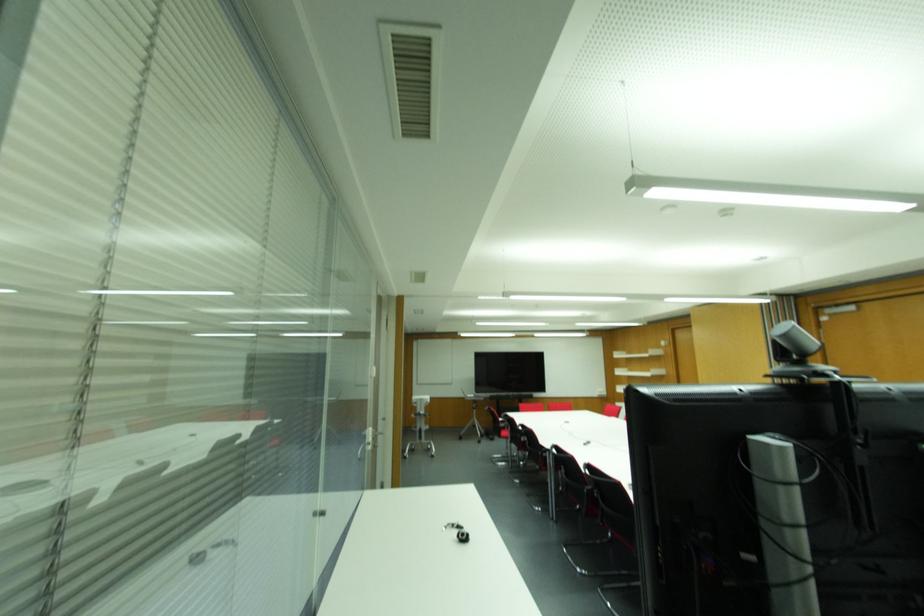
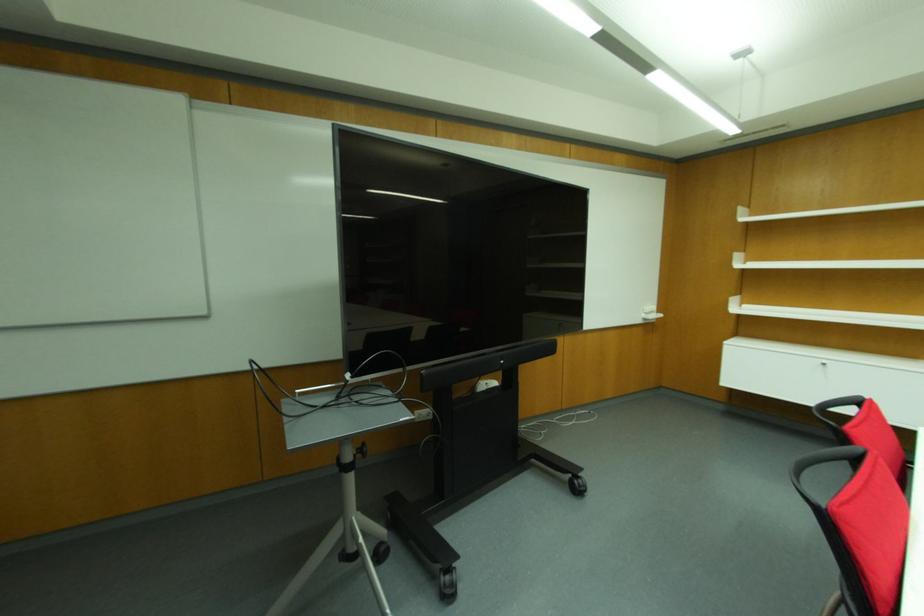
Where in the second image is the point corresponding to point 491,439 from the first image?

(448, 594)